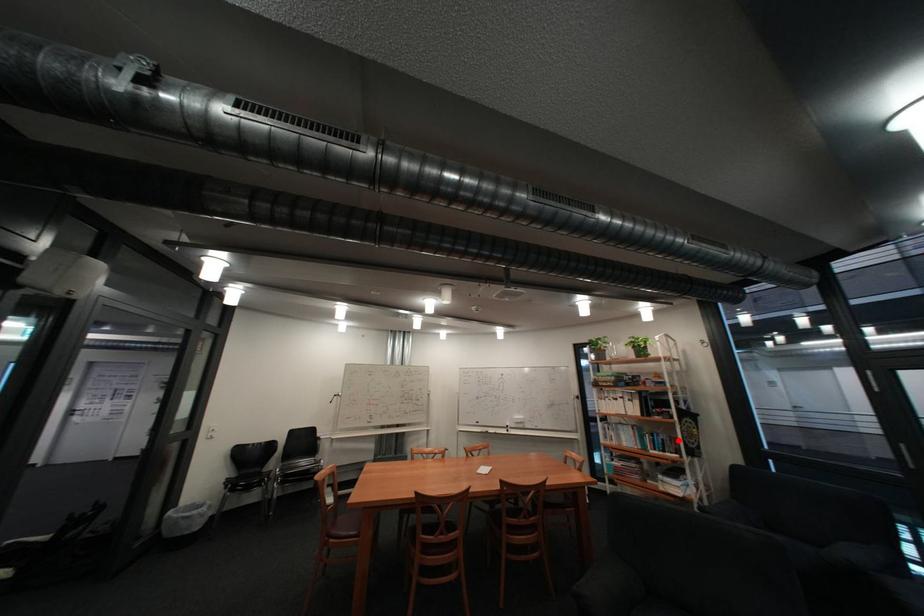
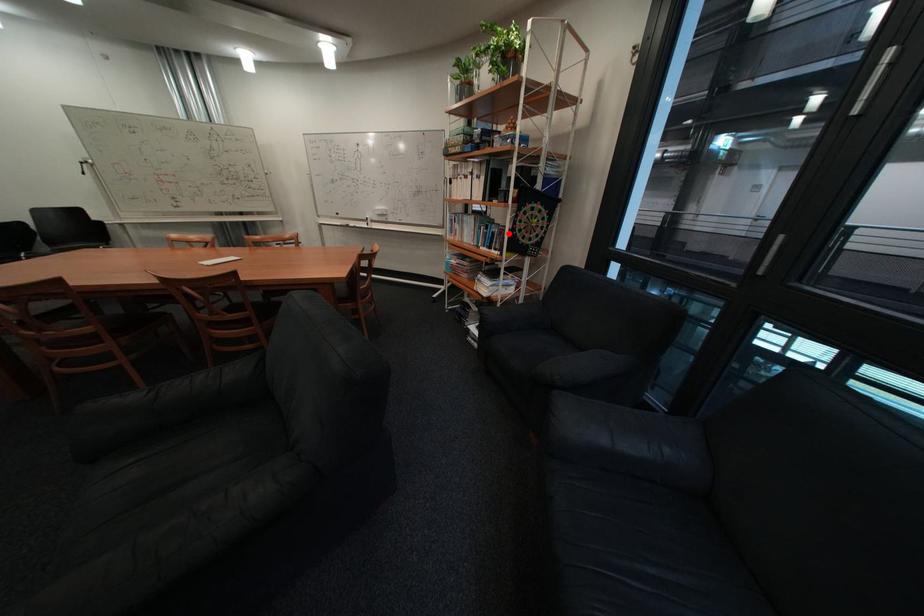
I am providing you with two images of the same scene from different viewpoints. A red point is marked on the first image and another point is marked on the second image. Is the marked point in image1 the same physical position as the marked point in image2?

Yes